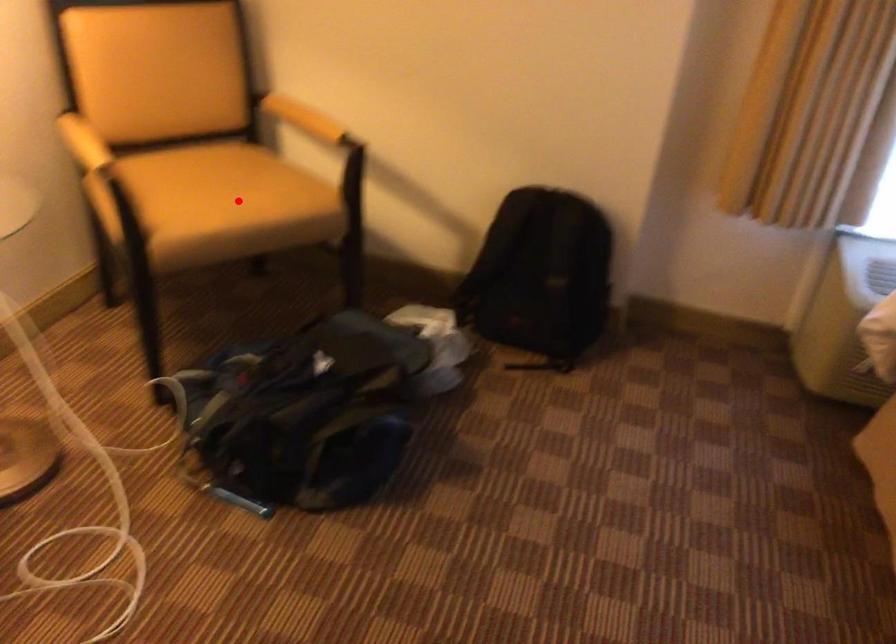
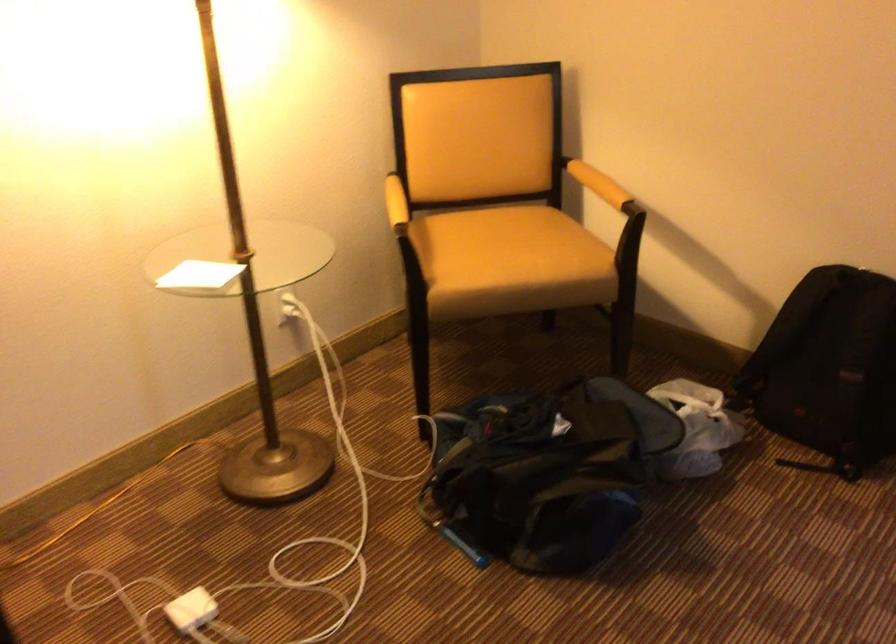
Where in the second image is the point corresponding to the highlighted location from the first image?

(510, 261)